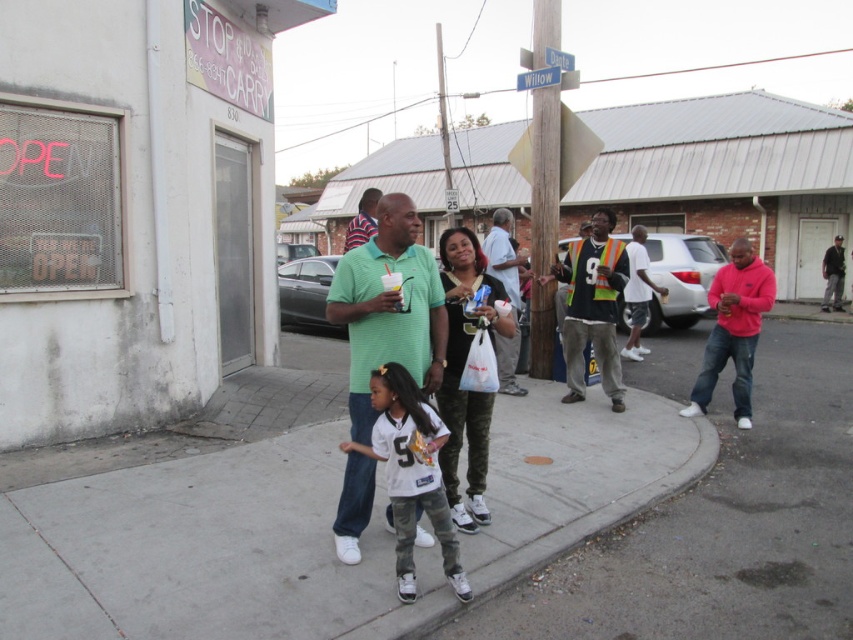
You are a customer trying to enter the store but there is a man in a green textured polo shirt at center and dark gray jeans at center blocking the entrance. Which part of the man should you avoid stepping on to get through?

The green textured polo shirt at center is positioned on the left side of dark gray jeans at center, so you should avoid stepping on the left side of the dark gray jeans at center where the shirt is located.

You are a photographer standing in front of the STOP AND GO CARRY store. You want to take a photo of the matte green shirt at center and dark gray jeans at center so that both are fully visible. Which object should you focus on first to ensure they are both in frame?

The matte green shirt at center is shorter than dark gray jeans at center, so you should focus on the dark gray jeans at center first to ensure both are fully visible in the photo.

What is the object located at the coordinates point (184, 541) in the image?

The object located at point (184, 541) is the gray concrete sidewalk at center.